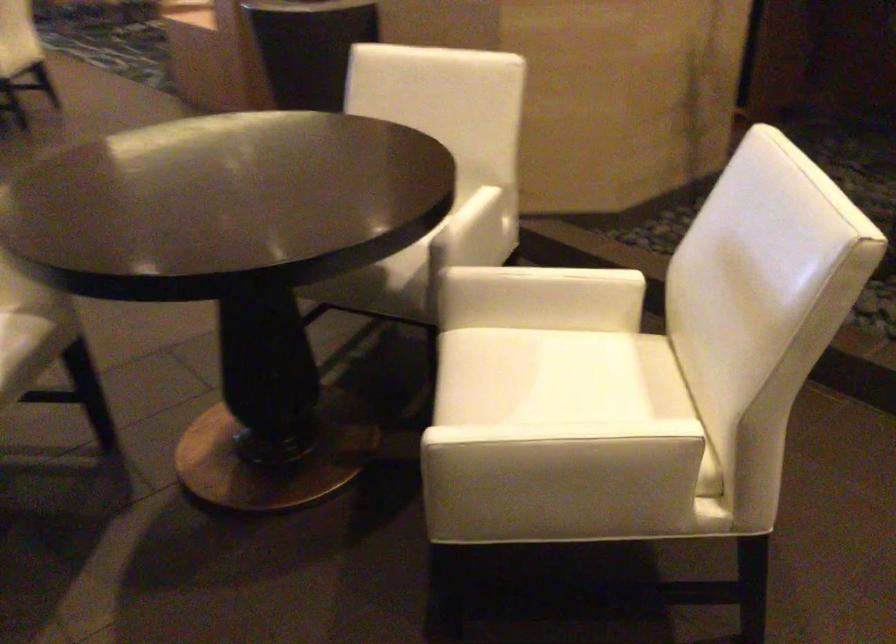
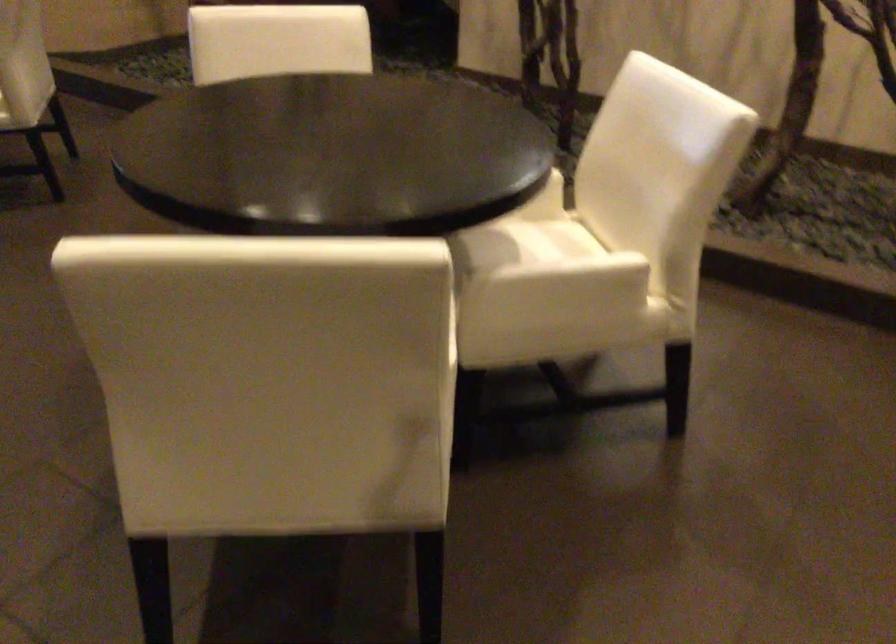
What movement of the cameraman would produce the second image?

The cameraman walked toward right, backward.